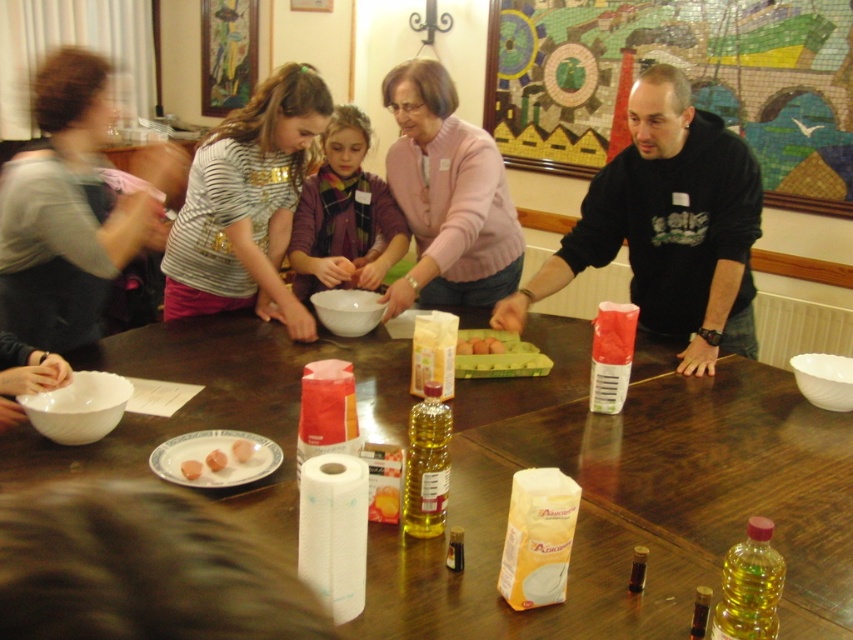
You are organizing a cooking class and need to place the pinkish matte sausages at center and the brown cardboard egg carton at center on a shelf. If the shelf has a width of 20 cm, can both items fit side by side?

The pinkish matte sausages at center are narrower than the brown cardboard egg carton at center. However, without knowing the exact widths of both items, it is impossible to determine if their combined width exceeds 20 cm. Additional measurements are needed.